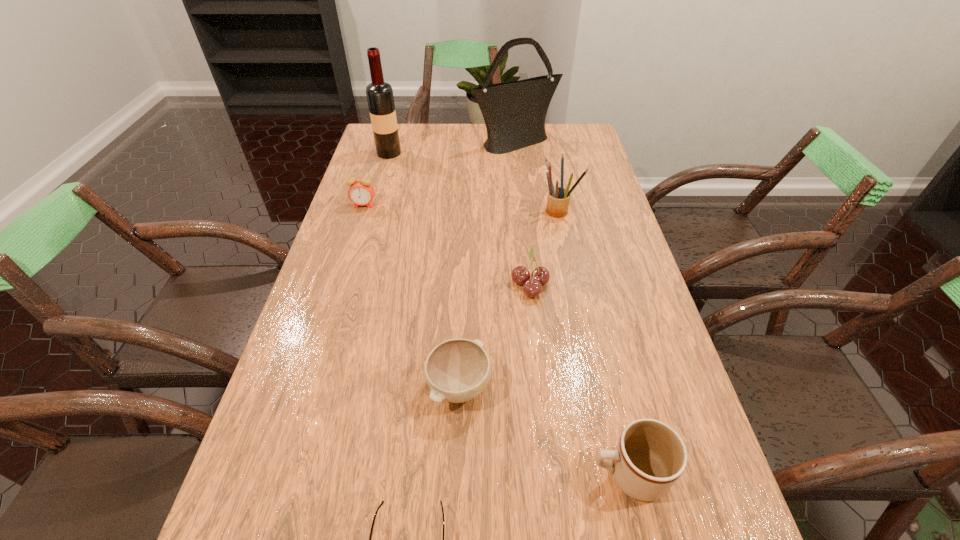
You are a GUI agent. You are given a task and a screenshot of the screen. Output one action in this format:
    pyautogui.click(x=<x>, y=<y>)
    Task: Click on the wine bottle at the far edge
    
    Given the screenshot: What is the action you would take?
    (x=380, y=98)

Where is `wine bottle positioned at the left edge`? The height and width of the screenshot is (540, 960). wine bottle positioned at the left edge is located at coordinates (380, 98).

Find the location of `alarm clock that is positioned at the left edge`. alarm clock that is positioned at the left edge is located at coordinates (361, 192).

Image resolution: width=960 pixels, height=540 pixels. Identify the location of shoulder bag present at the right edge. (514, 112).

Image resolution: width=960 pixels, height=540 pixels. I want to click on pencil box that is positioned at the right edge, so click(x=558, y=199).

The height and width of the screenshot is (540, 960). Identify the location of mug situated at the right edge. (650, 456).

Locate an element on the screen. object located in the far left corner section of the desktop is located at coordinates (380, 98).

The width and height of the screenshot is (960, 540). What are the coordinates of `object that is positioned at the far right corner` in the screenshot? It's located at (514, 112).

At what (x,y) coordinates should I click in order to perform the action: click on vacant space at the far edge of the desktop. Please return your answer as a coordinate pair (x, y). The width and height of the screenshot is (960, 540). Looking at the image, I should click on (432, 144).

Where is `vacant space at the left edge`? The width and height of the screenshot is (960, 540). vacant space at the left edge is located at coordinates (337, 454).